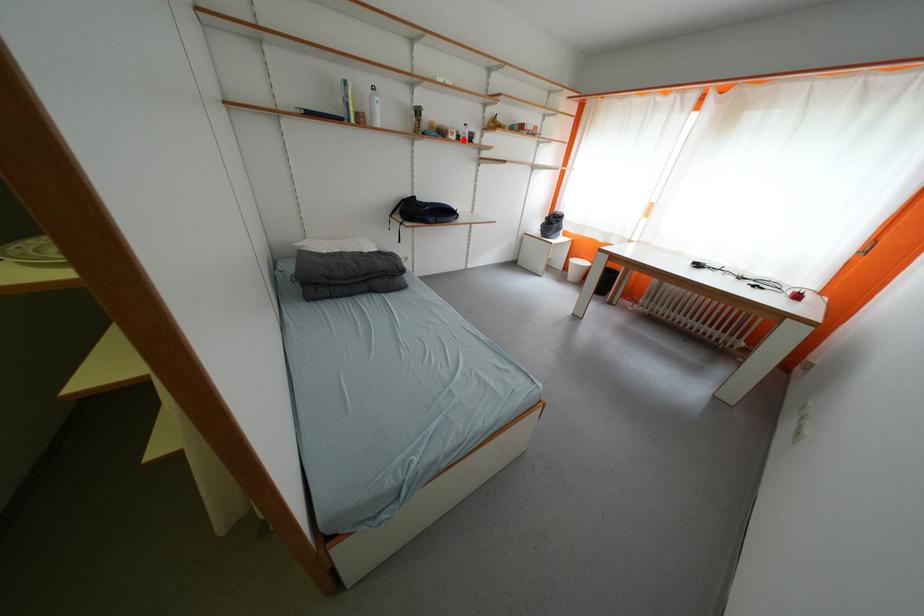
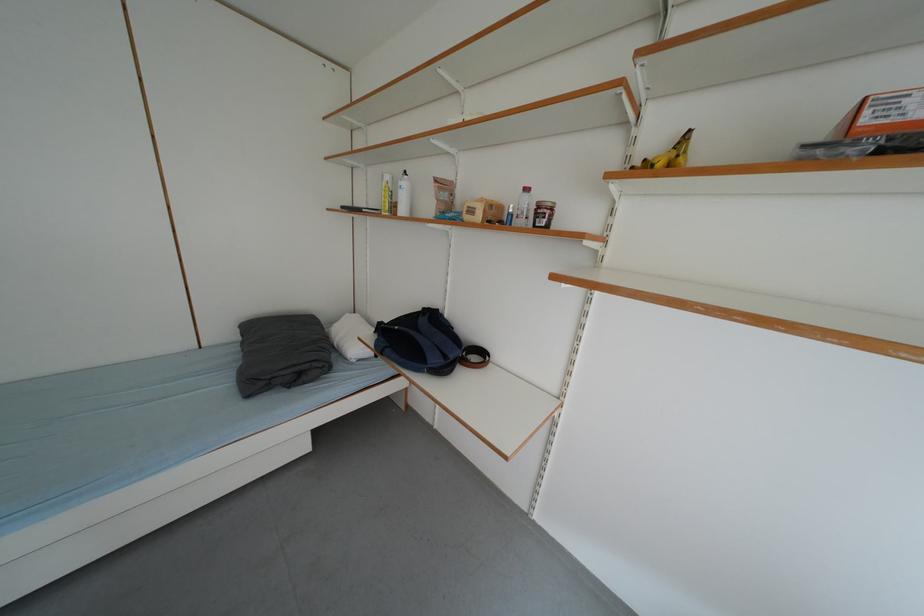
Locate, in the second image, the point that corresponds to the highlighted location in the first image.

(487, 220)